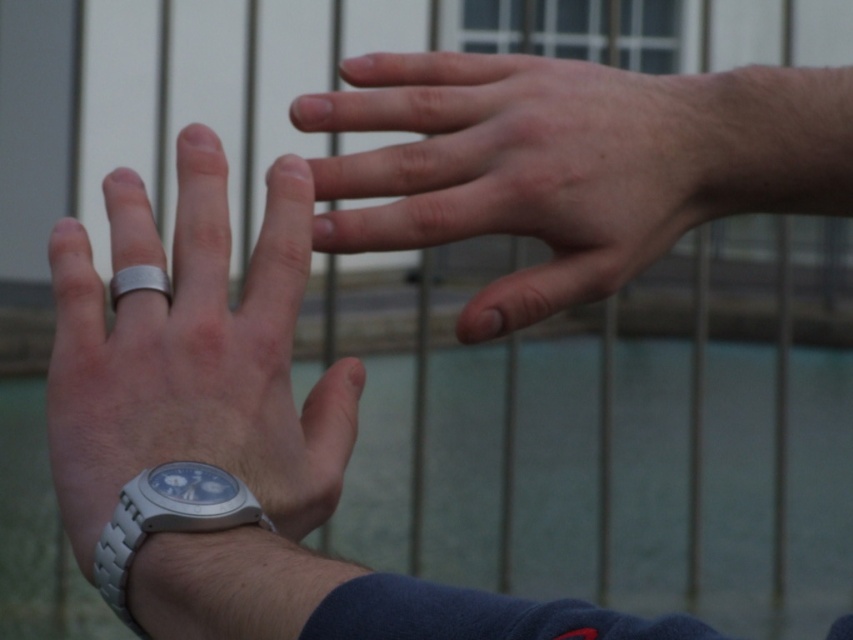
You are holding a 12 inch ruler and want to measure the distance between your eyes and the point at coordinates point (94, 577). Can you reach it with the ruler?

The point at coordinates point (94, 577) is 22.53 inches away from the viewer. Since the ruler is only 12 inches long, it is not long enough to reach that distance. You would need a longer measuring tool.

You are a photographer trying to capture the interaction between the smooth skin hand at upper center and the silver metallic watch at lower left. Given their sizes in the frame, which object will appear larger in your photo?

The smooth skin hand at upper center will appear larger in the photo because it has a greater height compared to the silver metallic watch at lower left.